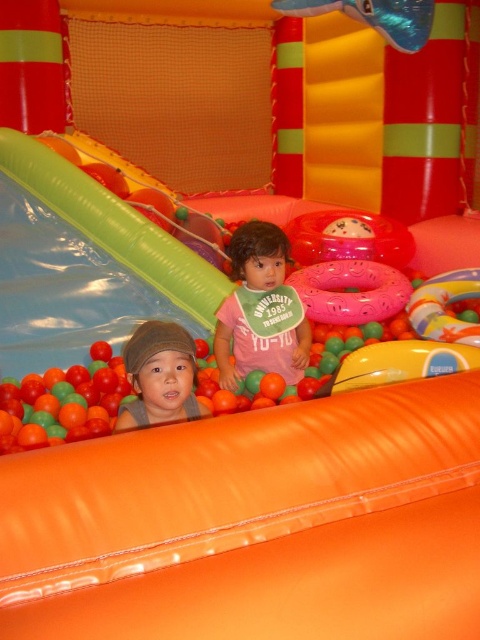
You are standing in the inflatable play area and want to move from the slide to the ball pit. Which point, point [88,225] or point [55,422], is closer to you as you start moving towards the ball pit?

Point [88,225] is closer to you because it is further to the viewer than point [55,422], meaning it is nearer in your line of sight when moving towards the ball pit.

You are a parent trying to locate your child who is playing in the orange matte ball pit at lower left. You see the green plastic slide at upper left. Is the slide located above or below the ball pit?

The green plastic slide at upper left is above the orange matte ball pit at lower left according to the description.